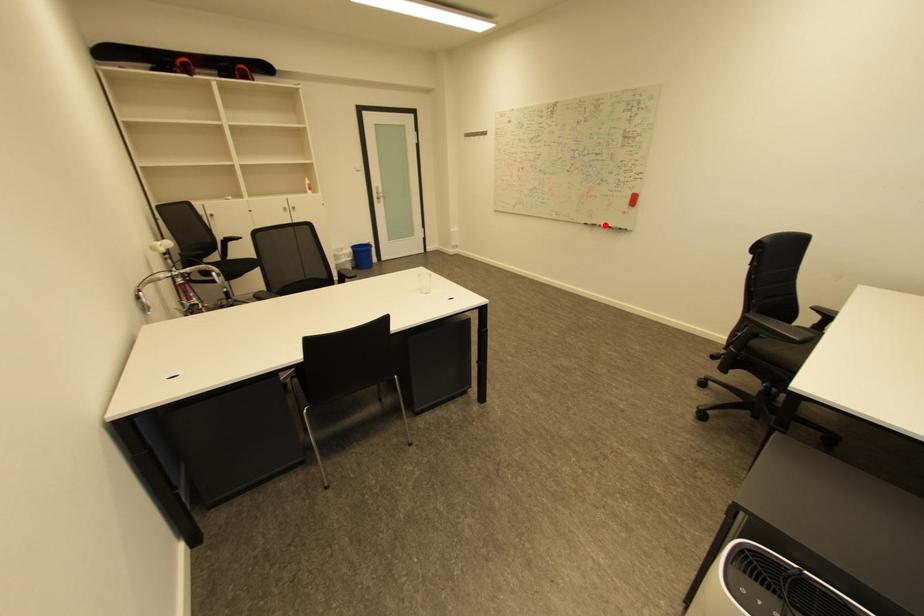
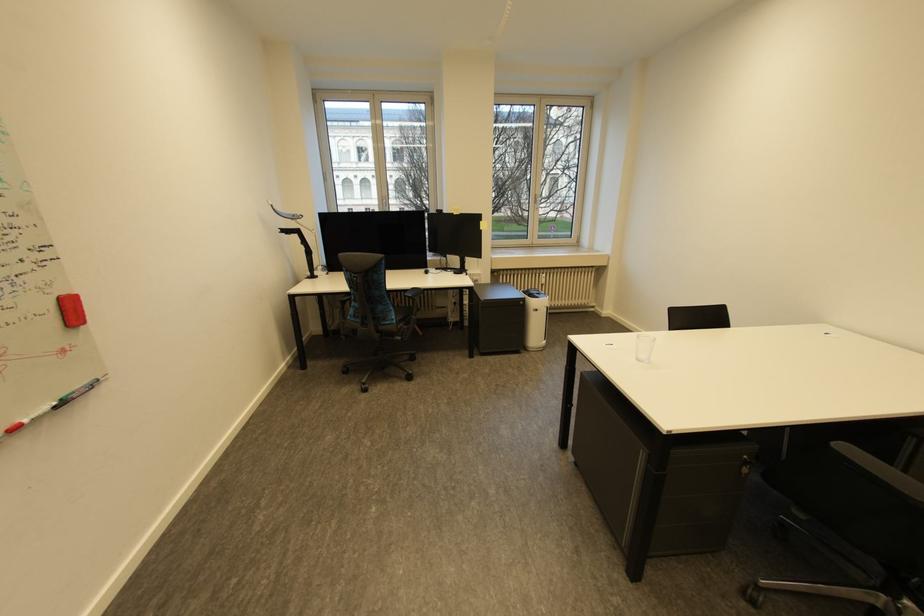
Question: I am providing you with two images of the same scene from different viewpoints. Given a red point in image1, look at the same physical point in image2. Is it:

Choices:
 (A) Closer to the viewpoint
 (B) Farther from the viewpoint

Answer: (B)